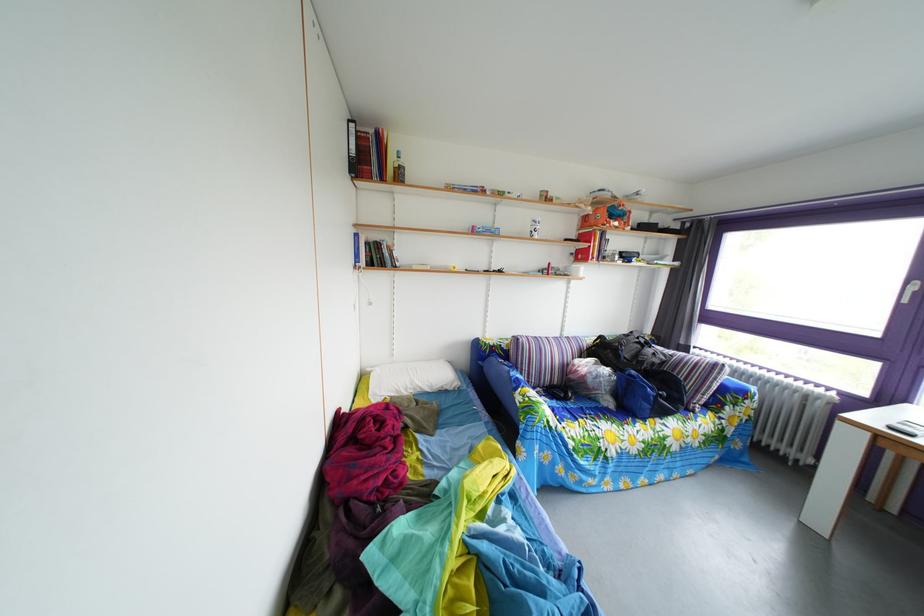
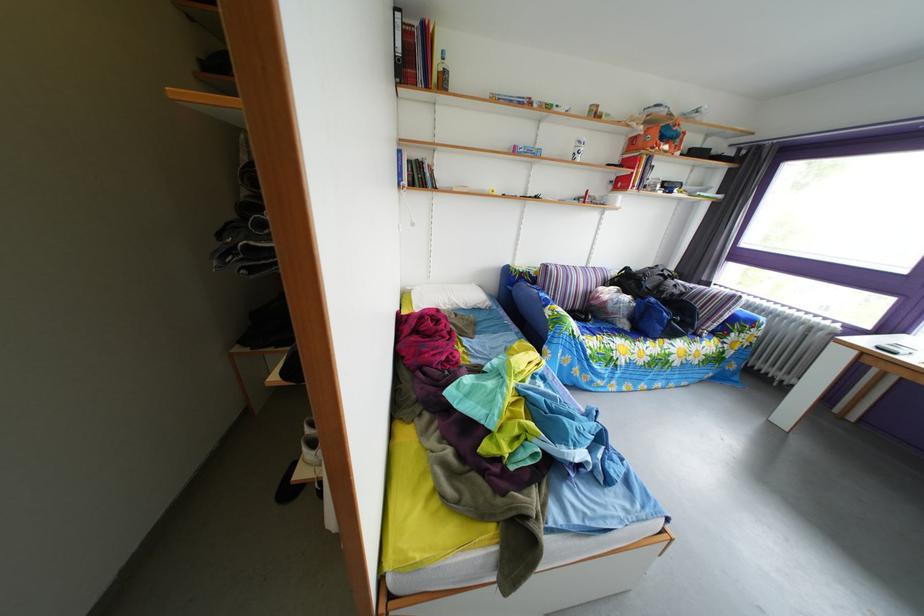
Find the pixel in the second image that matches [500,363] in the first image.

(529, 289)